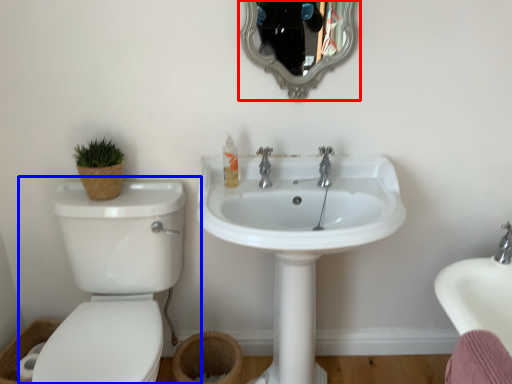
Question: Among these objects, which one is nearest to the camera, mirror (highlighted by a red box) or toilet (highlighted by a blue box)?

Choices:
 (A) mirror
 (B) toilet

Answer: (B)